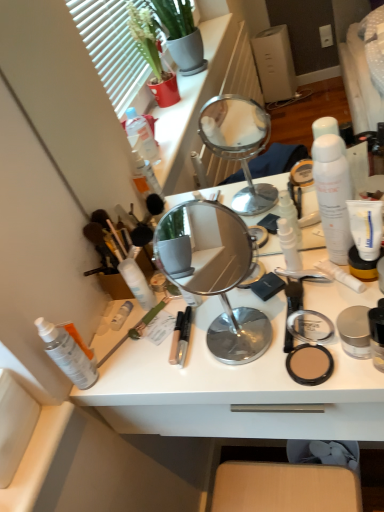
Where is `free space to the left of white matte spray can at upper right, the 6th toiletry viewed from the left`? The image size is (384, 512). free space to the left of white matte spray can at upper right, the 6th toiletry viewed from the left is located at coordinates 266,301.